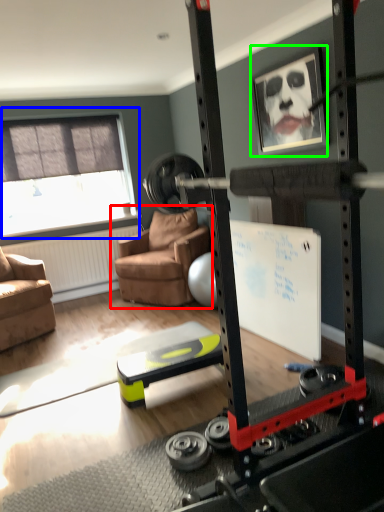
Question: Estimate the real-world distances between objects in this image. Which object is closer to chair (highlighted by a red box), window (highlighted by a blue box) or picture frame (highlighted by a green box)?

Choices:
 (A) window
 (B) picture frame

Answer: (A)